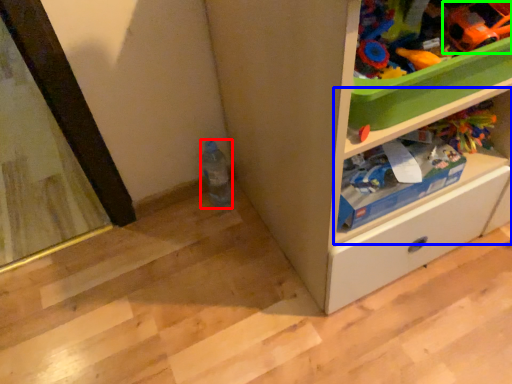
Question: Considering the real-world distances, which object is farthest from bottle (highlighted by a red box)? shelf (highlighted by a blue box) or toy (highlighted by a green box)?

Choices:
 (A) shelf
 (B) toy

Answer: (B)